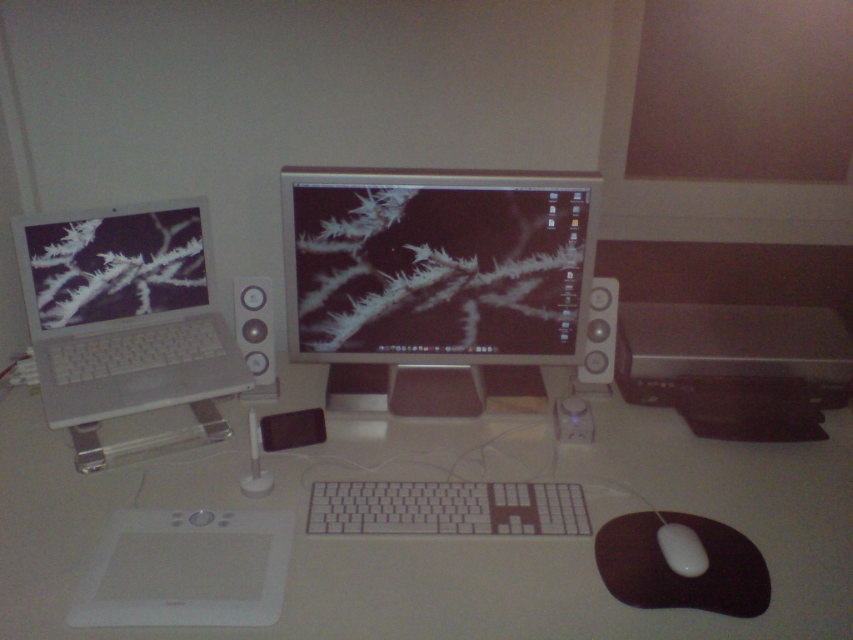
In the scene shown: You are organizing your desk and want to place a wireless charger that requires 15 inches of space between the matte black monitor at center and the white plastic keyboard at center. Can you fit the charger between them?

The distance between the matte black monitor at center and the white plastic keyboard at center is 14.92 inches, which is slightly less than the required 15 inches. Therefore, the wireless charger may not fit comfortably between them.

You are organizing your desk and want to place a new wireless charger between the matte black monitor at center and the white plastic keyboard at center. Based on their positions, where should you place the wireless charger?

The matte black monitor at center is located above the white plastic keyboard at center, so you should place the wireless charger below the matte black monitor at center and above the white plastic keyboard at center to position it between them.

You need to place a phone charger between the white plastic keyboard at center and the satin silver speaker at right. Which side should you place it on to ensure it doesn

The white plastic keyboard at center has a smaller size compared to the satin silver speaker at right. Therefore, placing the phone charger next to the smaller keyboard would leave more space for the larger speaker, ensuring better organization.